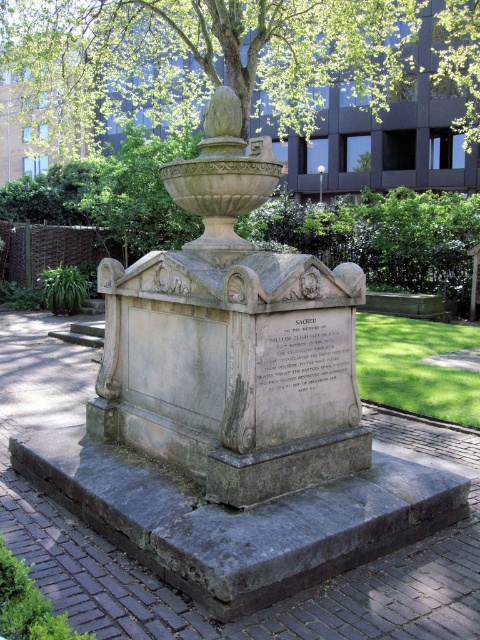
Question: Which object appears closest to the camera in this image?

Choices:
 (A) stone monument at center
 (B) green leafy tree at upper center

Answer: (A)

Question: Does stone monument at center have a lesser width compared to green leafy tree at upper center?

Choices:
 (A) no
 (B) yes

Answer: (B)

Question: Which object is farther from the camera taking this photo?

Choices:
 (A) stone monument at center
 (B) green leafy tree at upper center

Answer: (B)

Question: Which point is closer to the camera?

Choices:
 (A) (144, 264)
 (B) (357, 81)

Answer: (A)

Question: Where is stone monument at center located in relation to green leafy tree at upper center in the image?

Choices:
 (A) below
 (B) above

Answer: (A)

Question: Is stone monument at center wider than green leafy tree at upper center?

Choices:
 (A) yes
 (B) no

Answer: (B)